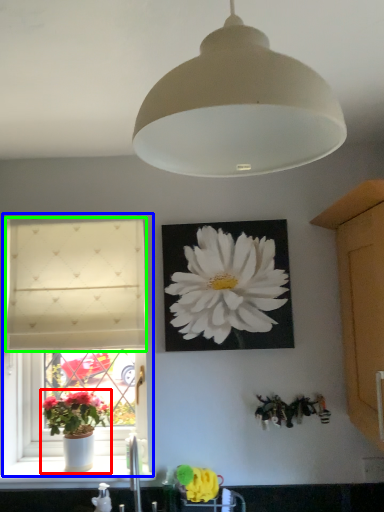
Question: Based on their relative distances, which object is nearer to houseplant (highlighted by a red box)? Choose from window (highlighted by a blue box) and curtain (highlighted by a green box).

Choices:
 (A) window
 (B) curtain

Answer: (A)